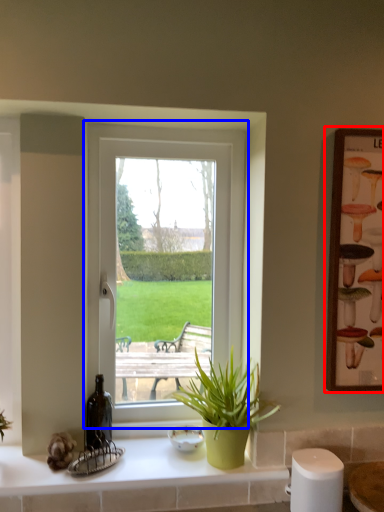
Question: Which point is closer to the camera, picture frame (highlighted by a red box) or window (highlighted by a blue box)?

Choices:
 (A) picture frame
 (B) window

Answer: (A)